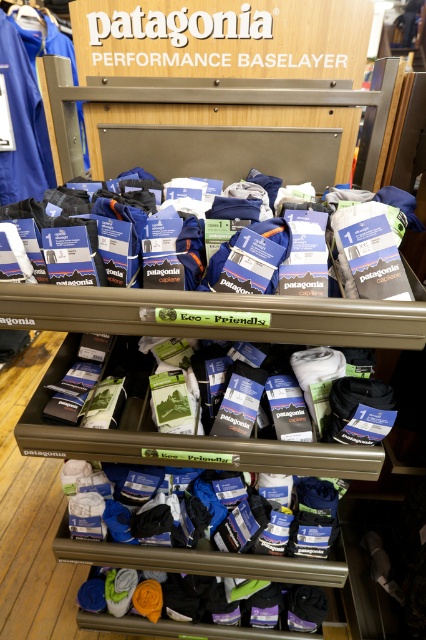
Does point (336, 445) come behind point (408, 208)?

No, it is in front of (408, 208).

Is point (91, 433) positioned after point (400, 189)?

No, (91, 433) is closer to viewer.

Where is `white cotton socks at center`? The height and width of the screenshot is (640, 426). white cotton socks at center is located at coordinates (180, 440).

Does blue fabric baselayer at center have a lesser height compared to blue fabric at upper left?

Yes, blue fabric baselayer at center is shorter than blue fabric at upper left.

Between blue fabric baselayer at center and blue fabric at upper left, which one is positioned higher?

Positioned higher is blue fabric at upper left.

Is point (400, 220) farther from viewer compared to point (20, 44)?

No, (400, 220) is closer to viewer.

At what (x,y) coordinates should I click in order to perform the action: click on blue fabric baselayer at center. Please return your answer as a coordinate pair (x, y). Looking at the image, I should click on (46, 216).

Between white cotton socks at center and blue fabric at upper left, which one is positioned lower?

white cotton socks at center is below.

At what (x,y) coordinates should I click in order to perform the action: click on white cotton socks at center. Please return your answer as a coordinate pair (x, y). The image size is (426, 640). Looking at the image, I should click on (180, 440).

Between point (124, 452) and point (28, 148), which one is positioned behind?

Positioned behind is point (28, 148).

At what (x,y) coordinates should I click in order to perform the action: click on white cotton socks at center. Please return your answer as a coordinate pair (x, y). Looking at the image, I should click on (180, 440).